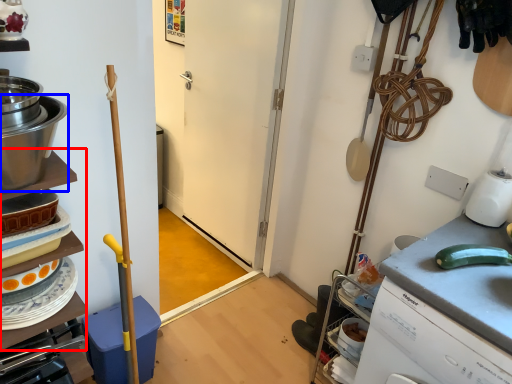
Question: Which of the following is the closest to the observer, shelf (highlighted by a red box) or kitchen appliance (highlighted by a blue box)?

Choices:
 (A) shelf
 (B) kitchen appliance

Answer: (B)